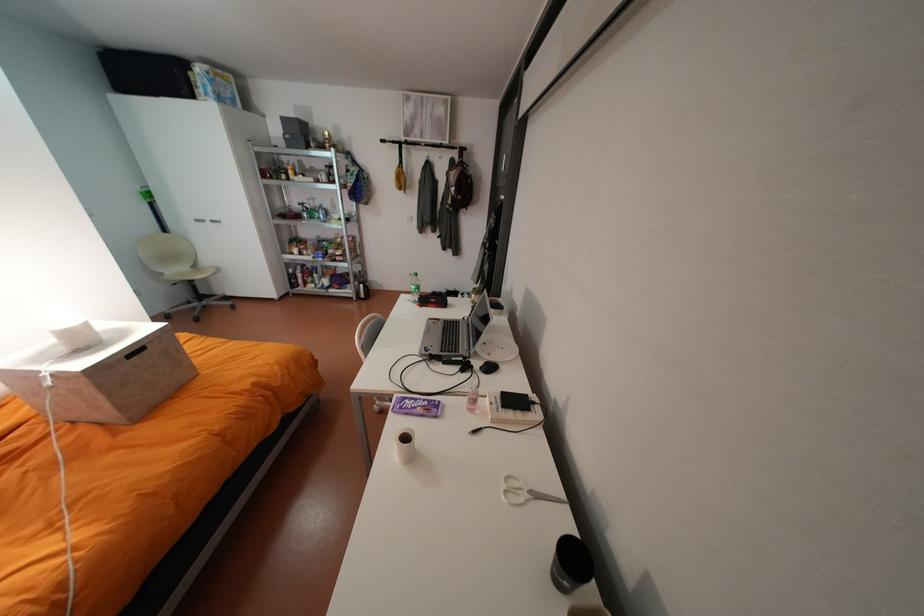
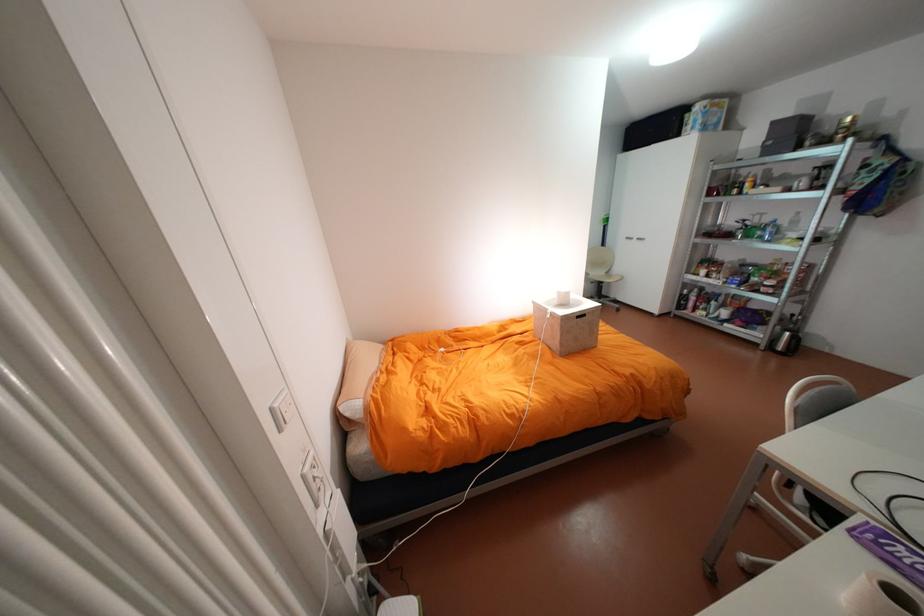
In the second image, find the point that corresponds to the point at 205,220 in the first image.

(636, 237)